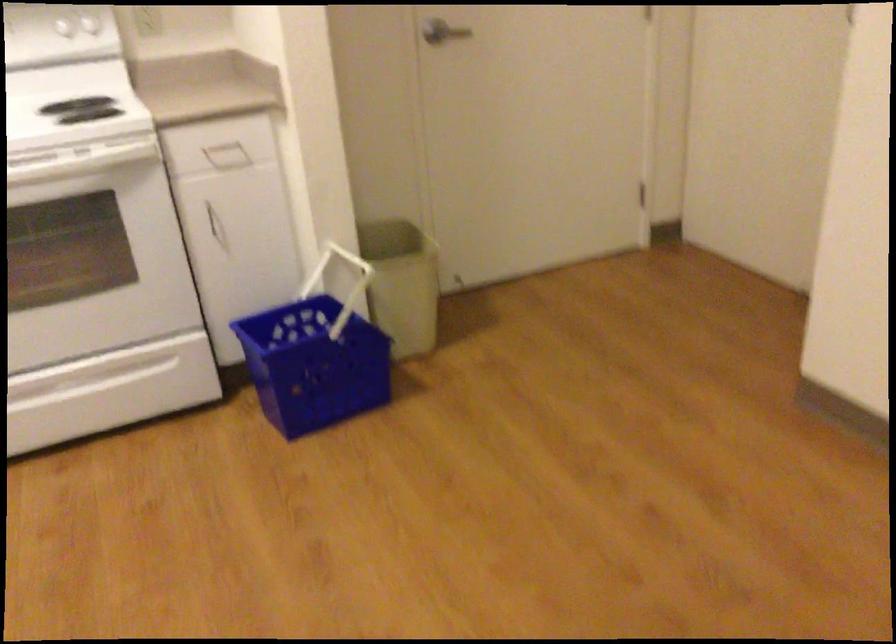
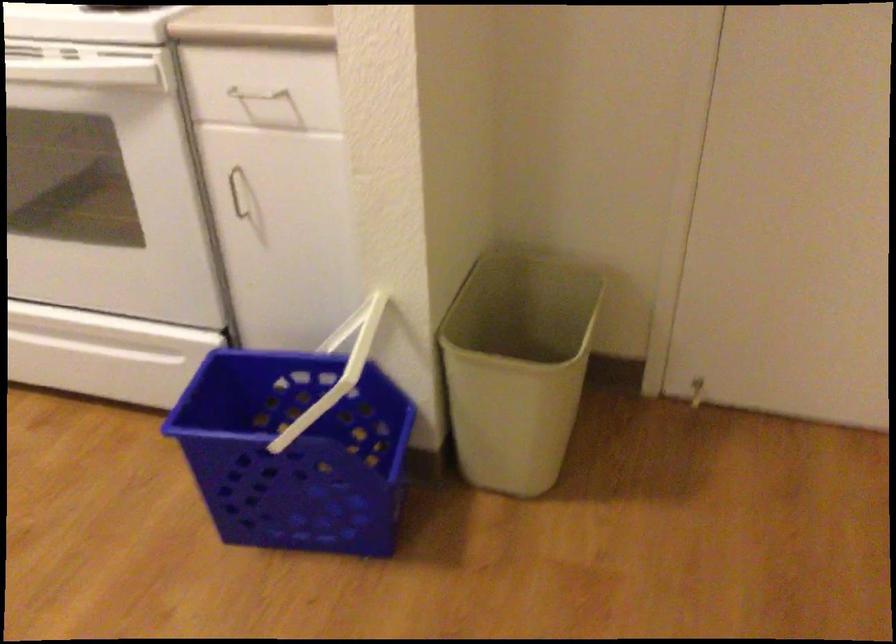
In the second image, find the point that corresponds to [204,214] in the first image.

(237, 192)